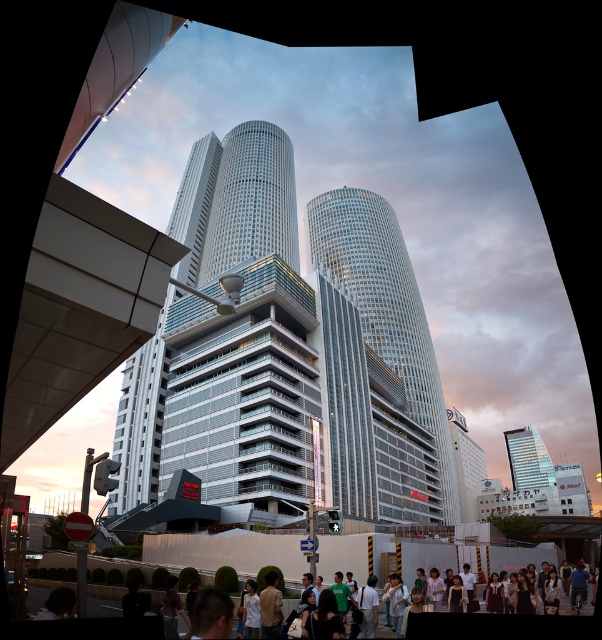
You are a drone operator tasked with flying a drone between the glassy silver skyscraper at center and the matte glass skyscraper at center. The drone has a wingspan of 1.5 meters. Can the drone safely navigate the space between them?

The glassy silver skyscraper at center is 362.74 feet away from the matte glass skyscraper at center. Since the distance between them is much greater than the drone wingspan of 1.5 meters, the drone can safely navigate the space between them.

You are an architect analyzing the urban layout. You observe the glassy steel skyscraper at center and the glassy silver skyscraper at center. Which one is positioned lower in the scene?

The glassy steel skyscraper at center is positioned lower than the glassy silver skyscraper at center.

You are standing at the origin point of this urban scene. If you want to walk directly towards the glassy steel skyscraper at center, which direction should you head? Please provide your answer in terms of coordinates relative to the origin point.

The glassy steel skyscraper at center is located at coordinates point (287, 356), so you should head towards that coordinate point to reach it directly.